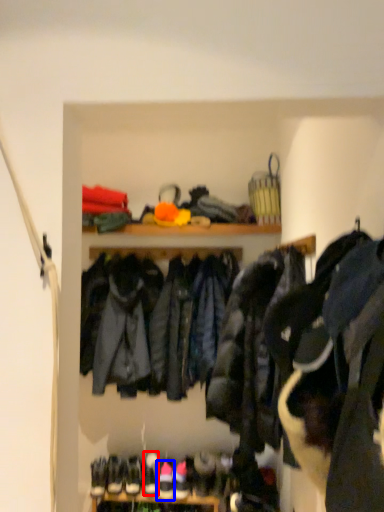
Question: Which object is closer to the camera taking this photo, footwear (highlighted by a red box) or footwear (highlighted by a blue box)?

Choices:
 (A) footwear
 (B) footwear

Answer: (B)